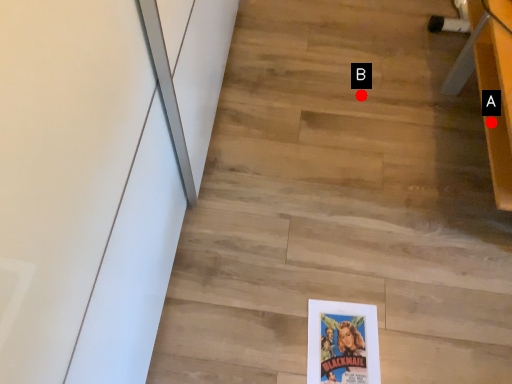
Question: Two points are circled on the image, labeled by A and B beside each circle. Which point is closer to the camera?

Choices:
 (A) A is closer
 (B) B is closer

Answer: (A)